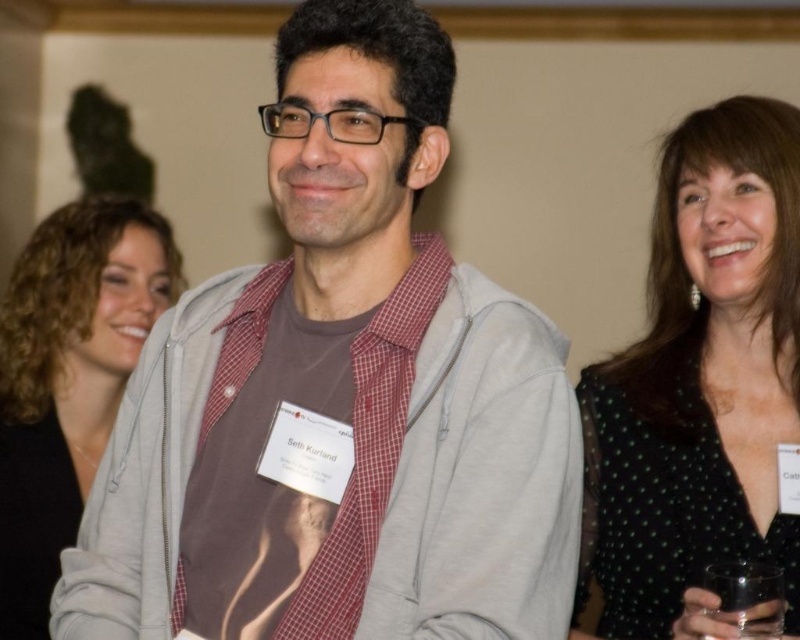
Question: Can you confirm if black dotted dress at upper right is smaller than transparent glass at lower right?

Choices:
 (A) yes
 (B) no

Answer: (B)

Question: Does black matte hair at upper left appear on the left side of transparent glass at lower right?

Choices:
 (A) no
 (B) yes

Answer: (B)

Question: Estimate the real-world distances between objects in this image. Which object is farther from the gray cotton hoodie at center?

Choices:
 (A) black matte hair at upper left
 (B) transparent glass at lower right
 (C) black dotted dress at upper right

Answer: (A)

Question: Which object is positioned closest to the gray cotton hoodie at center?

Choices:
 (A) black dotted dress at upper right
 (B) black matte hair at upper left

Answer: (A)

Question: Which point is closer to the camera taking this photo?

Choices:
 (A) (792, 397)
 (B) (720, 564)

Answer: (B)

Question: Is black matte hair at upper left positioned behind transparent glass at lower right?

Choices:
 (A) yes
 (B) no

Answer: (A)